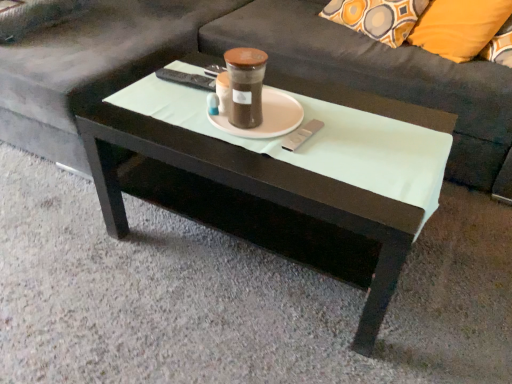
Identify the location of free space on the front side of white matte saucer at center. The image size is (512, 384). (272, 158).